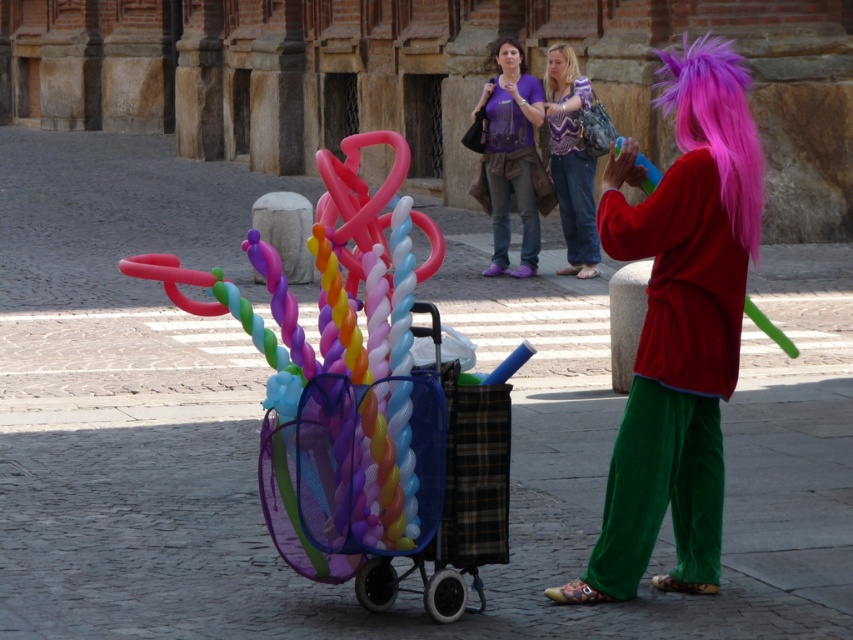
You are standing at the point marked as point (598,246) in the image. You want to walk towards the performer with the blue balloon. Is the performer located in front of or behind you?

The performer with the blue balloon is located behind you because the distance between point (598,246) and the viewer is 18.55 meters, meaning the viewer is positioned behind that point.

You are standing at the point with coordinates point [556,51] and want to move towards the point with coordinates point [525,67]. Which direction should you move to reach there?

To move from point [556,51] to point [525,67], you should move downward and to the right since the destination point is lower and further to the right on the coordinate plane.

You are a fashion designer observing the performer and their costume. Which object, the velvet red jacket at center or the purple silky hair at upper center, would you say occupies more visual space in the scene?

The velvet red jacket at center occupies more visual space in the scene as it is larger in size than the purple silky hair at upper center.